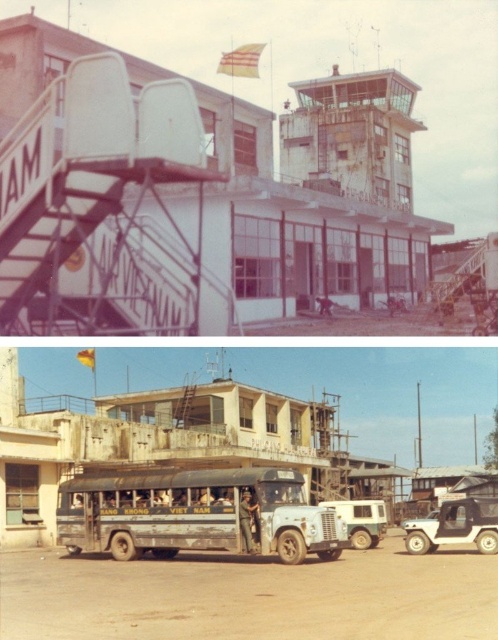
You are a photographer planning to take a new photo of the airport terminal. You want to ensure that both the dirty green bus at center and the white matte van at center are clearly visible. Based on their sizes in the existing image, which one should you focus on to ensure it occupies more space in your new photo?

The white matte van at center is larger than the dirty green bus at center, so focusing on the white matte van at center will ensure it occupies more space in the new photo.

You are standing at the base of the staircase marked with the word VIETNAM in the airport terminal. You want to take a photo of the flag flying atop the building. The point where you need to aim your camera is at coordinates point (257,468). Is this point within your camera lens range if your camera can focus up to 100 feet?

The distance of point (257,468) from viewer is 91.65 feet, which is within the camera lens range of 100 feet. Therefore, the camera can focus on that point.

From the picture: You are a photographer planning to capture both the dirty green bus at center and the white matte jeep at lower right in a single frame. Given their sizes, which vehicle should you position closer to the camera to ensure both appear proportionally sized in the photo?

To ensure both the dirty green bus at center and the white matte jeep at lower right appear proportionally sized in the photo, you should position the smaller white matte jeep at lower right closer to the camera since the dirty green bus at center is wider and can be placed farther back.